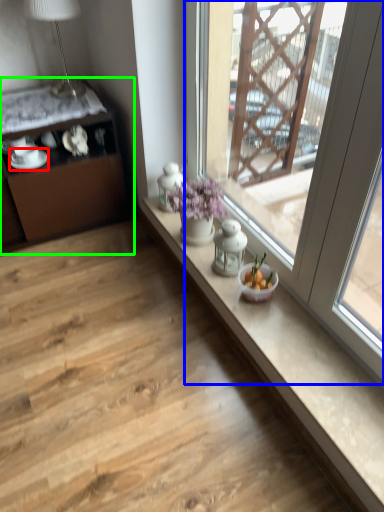
Question: Considering the real-world distances, which object is farthest from tableware (highlighted by a red box)? window (highlighted by a blue box) or cabinetry (highlighted by a green box)?

Choices:
 (A) window
 (B) cabinetry

Answer: (A)